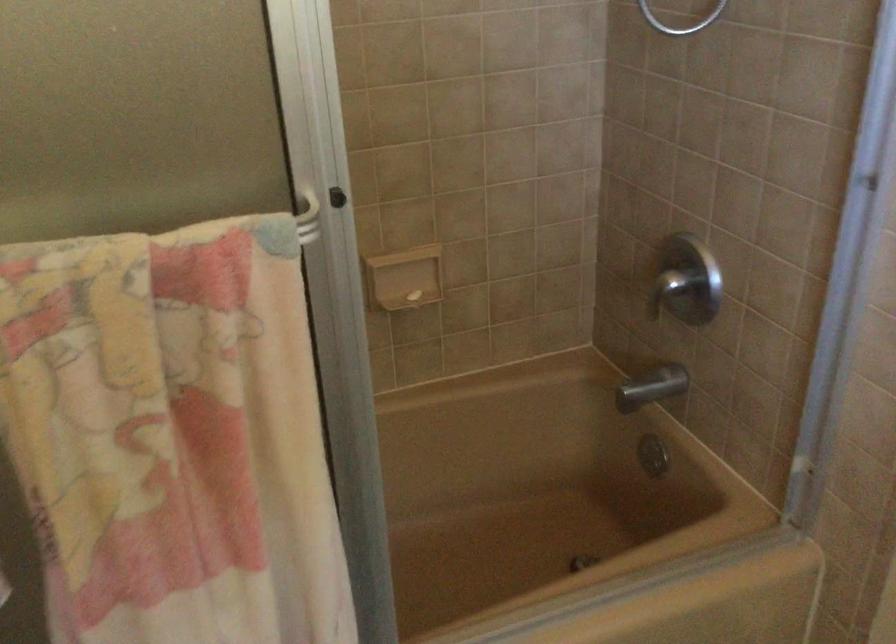
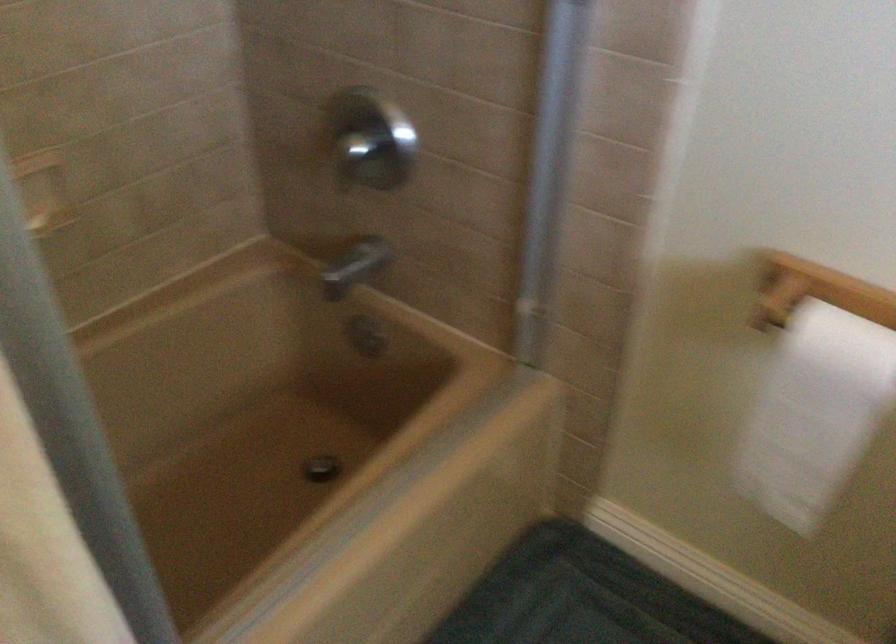
Question: The camera is either moving clockwise (left) or counter-clockwise (right) around the object. The first image is from the beginning of the video and the second image is from the end. Is the camera moving left or right when shooting the video?

Choices:
 (A) Left
 (B) Right

Answer: (A)